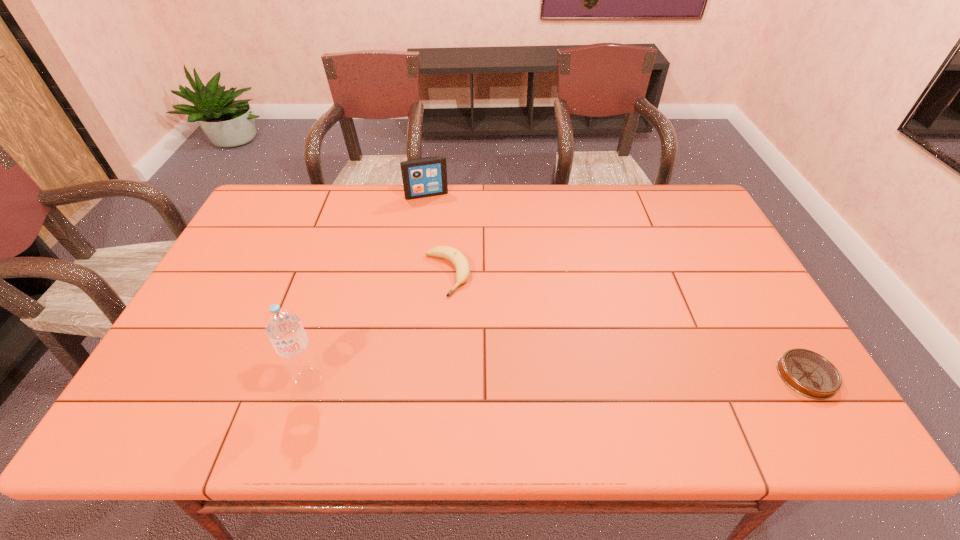
Identify the location of the tallest object. (282, 325).

Locate an element on the screen. The height and width of the screenshot is (540, 960). the leftmost object is located at coordinates (282, 325).

I want to click on the shortest object, so click(x=808, y=373).

Find the location of `compass`. compass is located at coordinates (808, 373).

Image resolution: width=960 pixels, height=540 pixels. What are the coordinates of `the third tallest object` in the screenshot? It's located at (461, 264).

Locate an element on the screen. Image resolution: width=960 pixels, height=540 pixels. the second farthest object is located at coordinates (461, 264).

Identify the location of the farthest object. (424, 177).

Where is `iPod`? The height and width of the screenshot is (540, 960). iPod is located at coordinates (424, 177).

Locate an element on the screen. The height and width of the screenshot is (540, 960). free location located 0.120m on the left of the leftmost object is located at coordinates pos(242,380).

Identify the location of free space located on the left of the compass. (680, 375).